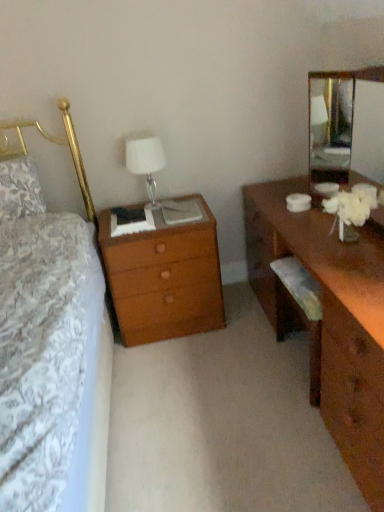
Question: Can white fabric lampshade at upper center be found inside clear glass mirror at upper right?

Choices:
 (A) no
 (B) yes

Answer: (A)

Question: From the image's perspective, would you say clear glass mirror at upper right is shown under white fabric lampshade at upper center?

Choices:
 (A) no
 (B) yes

Answer: (B)

Question: Considering the relative sizes of clear glass mirror at upper right and white fabric lampshade at upper center in the image provided, is clear glass mirror at upper right smaller than white fabric lampshade at upper center?

Choices:
 (A) no
 (B) yes

Answer: (A)

Question: From a real-world perspective, is clear glass mirror at upper right located higher than white fabric lampshade at upper center?

Choices:
 (A) no
 (B) yes

Answer: (B)

Question: From the image's perspective, is clear glass mirror at upper right on white fabric lampshade at upper center?

Choices:
 (A) no
 (B) yes

Answer: (A)

Question: From their relative heights in the image, would you say white fabric lampshade at upper center is taller or shorter than brown wooden desk at right?

Choices:
 (A) short
 (B) tall

Answer: (A)

Question: Visually, is white fabric lampshade at upper center positioned to the left or to the right of brown wooden desk at right?

Choices:
 (A) left
 (B) right

Answer: (A)

Question: From a real-world perspective, is white fabric lampshade at upper center above or below brown wooden desk at right?

Choices:
 (A) below
 (B) above

Answer: (B)

Question: Is white fabric lampshade at upper center wider or thinner than brown wooden desk at right?

Choices:
 (A) thin
 (B) wide

Answer: (A)

Question: From a real-world perspective, is brown wooden desk at right physically located above or below clear glass mirror at upper right?

Choices:
 (A) below
 (B) above

Answer: (A)

Question: Looking at the image, does brown wooden desk at right seem bigger or smaller compared to clear glass mirror at upper right?

Choices:
 (A) big
 (B) small

Answer: (A)

Question: Is brown wooden desk at right to the left or to the right of clear glass mirror at upper right in the image?

Choices:
 (A) right
 (B) left

Answer: (B)

Question: In terms of width, does brown wooden desk at right look wider or thinner when compared to clear glass mirror at upper right?

Choices:
 (A) thin
 (B) wide

Answer: (B)

Question: From the image's perspective, is brown wooden desk at right above or below wooden nightstand at left?

Choices:
 (A) below
 (B) above

Answer: (B)

Question: From a real-world perspective, is brown wooden desk at right physically located above or below wooden nightstand at left?

Choices:
 (A) below
 (B) above

Answer: (B)